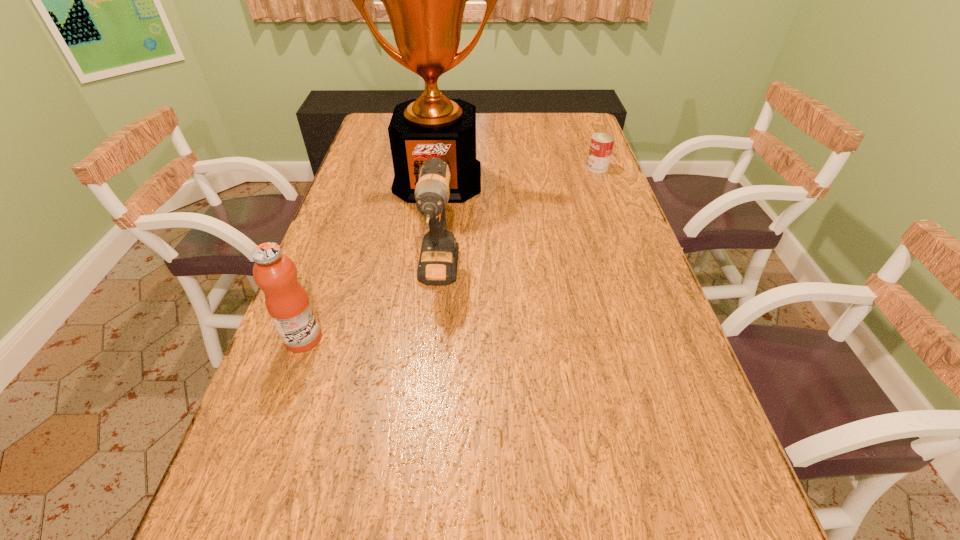
What are the coordinates of `free location located on the front label of the shortest object` in the screenshot? It's located at (474, 167).

Where is `trophy cup present at the left edge`? This screenshot has width=960, height=540. trophy cup present at the left edge is located at coordinates (425, 0).

Where is `fruit juice present at the left edge`? fruit juice present at the left edge is located at coordinates pos(287,302).

Where is `object situated at the right edge`? This screenshot has width=960, height=540. object situated at the right edge is located at coordinates [601, 146].

I want to click on vacant space at the far edge of the desktop, so click(503, 139).

Image resolution: width=960 pixels, height=540 pixels. I want to click on vacant area at the left edge, so click(x=378, y=143).

The image size is (960, 540). I want to click on free spot at the right edge of the desktop, so click(719, 456).

In the image, there is a desktop. Where is `blank space at the far left corner`? The image size is (960, 540). blank space at the far left corner is located at coordinates (382, 123).

The height and width of the screenshot is (540, 960). In order to click on free space at the far right corner of the desktop in this screenshot , I will do `click(547, 115)`.

Find the location of a particular element. unoccupied position between the fruit juice and the tallest object is located at coordinates (371, 259).